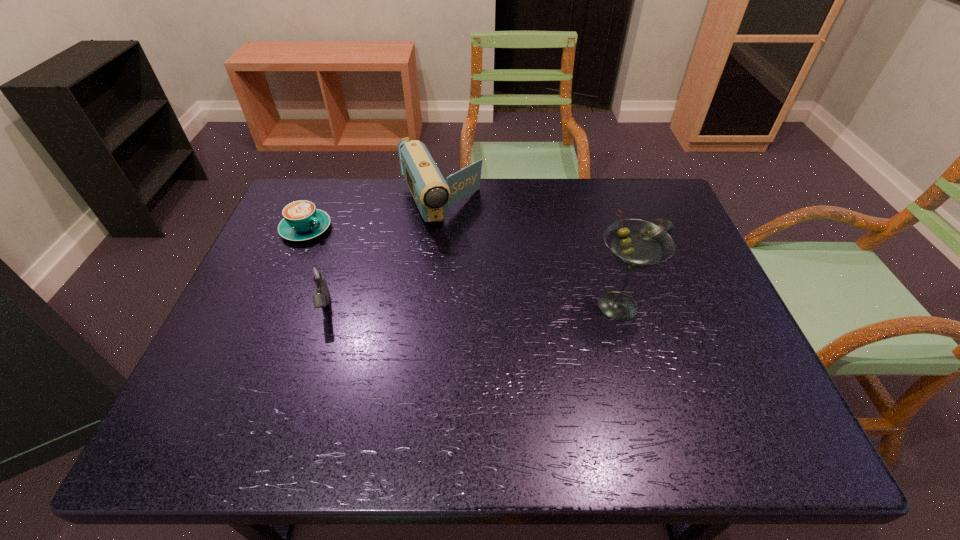
Where is `vacant space located 0.380m on the right of the third tallest object`? The width and height of the screenshot is (960, 540). vacant space located 0.380m on the right of the third tallest object is located at coordinates pyautogui.click(x=492, y=307).

You are a GUI agent. You are given a task and a screenshot of the screen. Output one action in this format:
    pyautogui.click(x=<x>, y=<y>)
    Task: Click on the vacant space situated 0.370m on the back of the second object from right to left
    The height and width of the screenshot is (540, 960).
    Given the screenshot: What is the action you would take?
    pyautogui.click(x=587, y=198)

Identify the location of vacant area located on the wheel side of the shortest object. Image resolution: width=960 pixels, height=540 pixels. [x=568, y=272].

The height and width of the screenshot is (540, 960). Find the location of `vacant region located on the wheel side of the shortest object`. vacant region located on the wheel side of the shortest object is located at coordinates (565, 273).

Locate an element on the screen. This screenshot has height=540, width=960. free space located on the wheel side of the shortest object is located at coordinates (587, 264).

Find the location of `blank space located on the side of the camcorder with the flip-out screen`. blank space located on the side of the camcorder with the flip-out screen is located at coordinates [509, 342].

You are a GUI agent. You are given a task and a screenshot of the screen. Output one action in this format:
    pyautogui.click(x=<x>, y=<y>)
    Task: Click on the free space located on the side of the camcorder with the flip-out screen
    
    Given the screenshot: What is the action you would take?
    [465, 257]

Locate an element on the screen. blank space located 0.080m on the side of the camcorder with the flip-out screen is located at coordinates (463, 252).

Locate an element on the screen. free space located 0.070m with the handle on the right side of the leftmost object is located at coordinates (342, 246).

I want to click on vacant space positioned with the handle on the right side of the leftmost object, so click(384, 267).